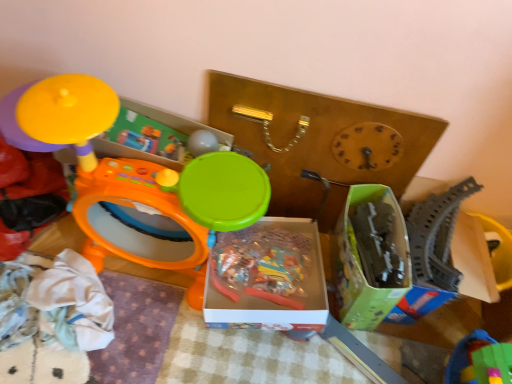
Question: Based on their positions, is green plastic blocks at lower right, which is counted as the 2th toy, starting from the right, located to the left or right of gray plastic train track at right, which is the 4th toy in left-to-right order?

Choices:
 (A) left
 (B) right

Answer: (A)

Question: In terms of height, does green plastic blocks at lower right, which is counted as the 2th toy, starting from the right, look taller or shorter compared to gray plastic train track at right, positioned as the first toy in right-to-left order?

Choices:
 (A) tall
 (B) short

Answer: (B)

Question: Estimate the real-world distances between objects in this image. Which object is closer to the gray plastic train track at right, which is the 4th toy in left-to-right order?

Choices:
 (A) green plastic blocks at lower right, the 3th toy viewed from the left
 (B) translucent plastic box at center, which is the first storage box in left-to-right order
 (C) matte yellow toy at upper left, placed as the 1th toy when sorted from left to right
 (D) green cardboard box at center-right, placed as the 2th storage box when sorted from left to right
 (E) orange plastic drum at left, the 3th toy viewed from the right

Answer: (D)

Question: Estimate the real-world distances between objects in this image. Which object is farther from the green plastic blocks at lower right, which is counted as the 2th toy, starting from the right?

Choices:
 (A) green cardboard box at center-right, the 1th storage box when ordered from right to left
 (B) translucent plastic box at center, the 2th storage box in the right-to-left sequence
 (C) orange plastic drum at left, the 3th toy viewed from the right
 (D) gray plastic train track at right, which is the 4th toy in left-to-right order
 (E) matte yellow toy at upper left, placed as the 1th toy when sorted from left to right

Answer: (E)